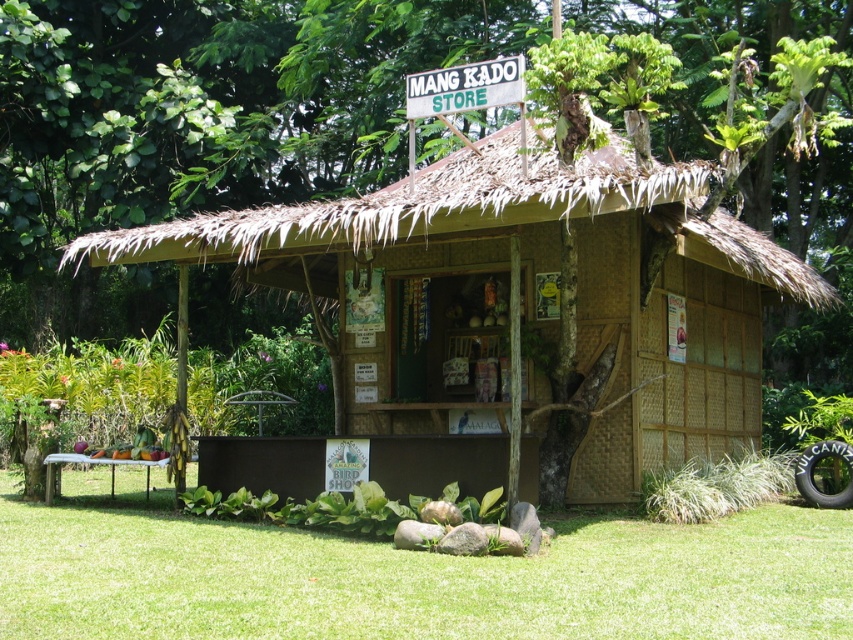
Question: Based on their relative distances, which object is farther from the bamboo hut at center?

Choices:
 (A) green wooden sign at upper center
 (B) green grass at lower center

Answer: (B)

Question: Which object is the farthest from the green wooden sign at upper center?

Choices:
 (A) bamboo hut at center
 (B) green grass at lower center

Answer: (B)

Question: Observing the image, what is the correct spatial positioning of bamboo hut at center in reference to green grass at lower center?

Choices:
 (A) right
 (B) left

Answer: (A)

Question: Estimate the real-world distances between objects in this image. Which object is closer to the green wooden sign at upper center?

Choices:
 (A) bamboo hut at center
 (B) green grass at lower center

Answer: (A)

Question: Can you confirm if green grass at lower center is smaller than green wooden sign at upper center?

Choices:
 (A) no
 (B) yes

Answer: (A)

Question: Observing the image, what is the correct spatial positioning of bamboo hut at center in reference to green wooden sign at upper center?

Choices:
 (A) left
 (B) right

Answer: (B)